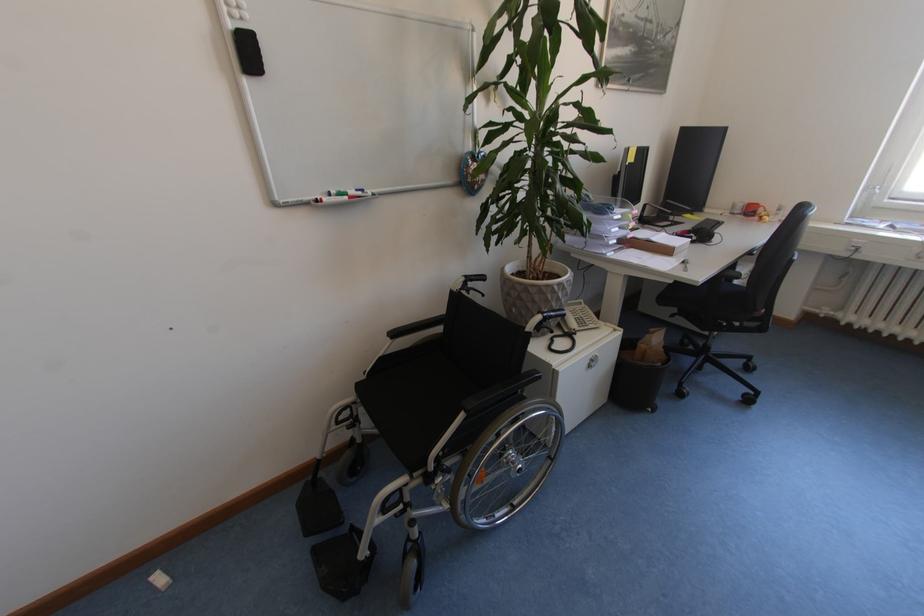
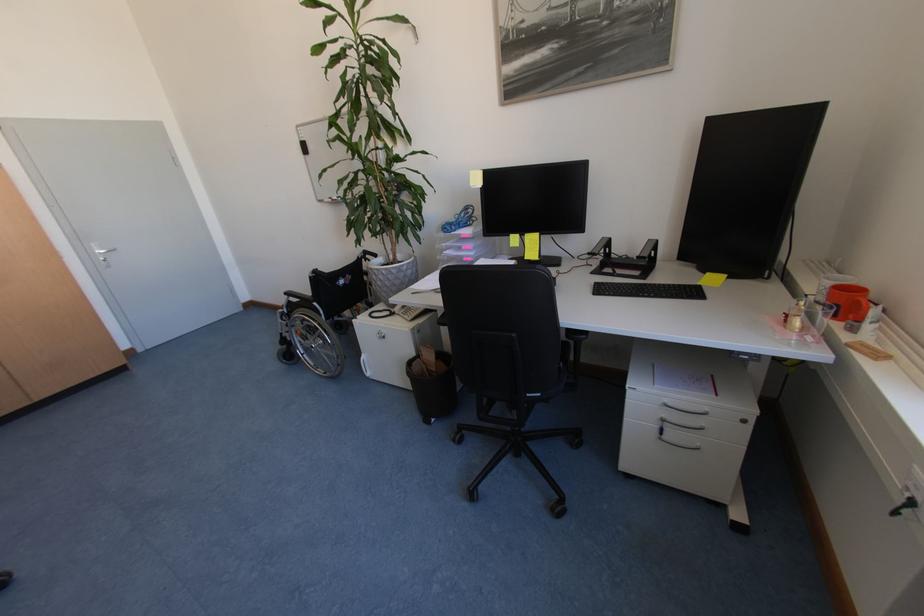
Locate, in the second image, the point that corresponds to [521,508] in the first image.

(333, 374)